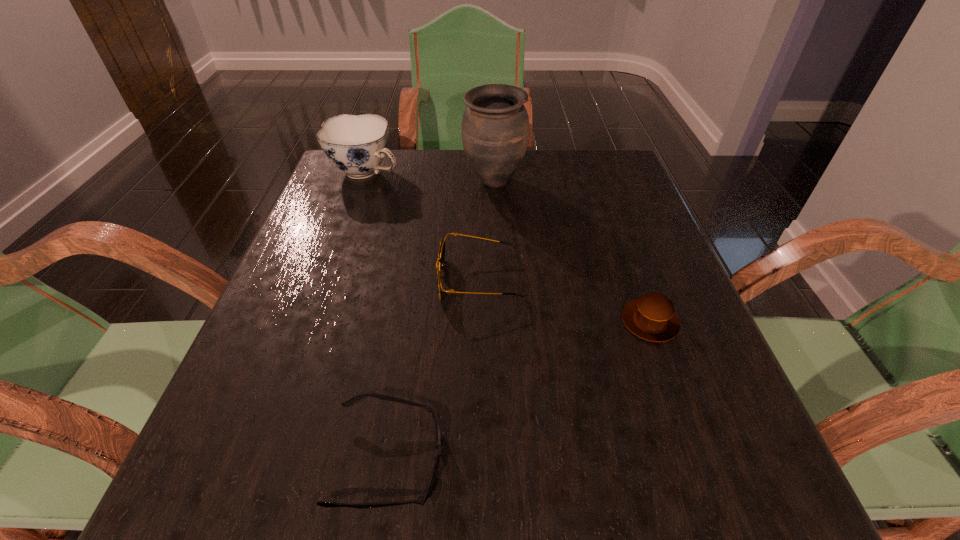
Locate an element on the screen. The height and width of the screenshot is (540, 960). urn is located at coordinates (495, 127).

The width and height of the screenshot is (960, 540). What are the coordinates of `chinaware` in the screenshot? It's located at (356, 144).

Where is `the farther sunglasses`? The image size is (960, 540). the farther sunglasses is located at coordinates (440, 264).

This screenshot has height=540, width=960. Identify the location of the rightmost object. (652, 317).

Locate an element on the screen. the shorter sunglasses is located at coordinates (421, 499).

At what (x,y) coordinates should I click in order to perform the action: click on the shortest object. Please return your answer as a coordinate pair (x, y). The width and height of the screenshot is (960, 540). Looking at the image, I should click on (421, 499).

Identify the location of vacant space located on the front of the tallest object. (499, 292).

The height and width of the screenshot is (540, 960). Find the location of `free space located on the front of the fourth shortest object`. free space located on the front of the fourth shortest object is located at coordinates (351, 217).

Where is `free space located 0.160m on the front-facing side of the taller sunglasses`? The height and width of the screenshot is (540, 960). free space located 0.160m on the front-facing side of the taller sunglasses is located at coordinates (353, 280).

Find the location of a particular element. The width and height of the screenshot is (960, 540). vacant space positioned 0.270m on the front-facing side of the taller sunglasses is located at coordinates 296,280.